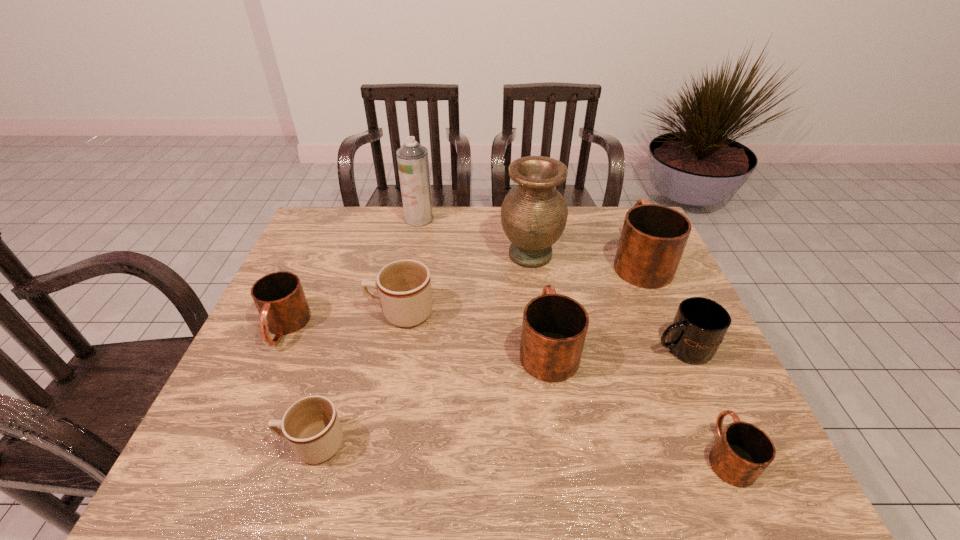
Find the location of `free space located on the side of the bigger brown mug with the handle`. free space located on the side of the bigger brown mug with the handle is located at coordinates (313, 313).

Where is `free region located 0.260m on the side of the bigger brown mug with the handle`? free region located 0.260m on the side of the bigger brown mug with the handle is located at coordinates (273, 313).

Where is `free space located with the handle on the side of the black mug`? Image resolution: width=960 pixels, height=540 pixels. free space located with the handle on the side of the black mug is located at coordinates (577, 348).

Identify the location of vacant space located with the handle on the side of the black mug. (609, 348).

Locate an element on the screen. This screenshot has height=540, width=960. free space located 0.210m with the handle on the side of the black mug is located at coordinates (569, 348).

This screenshot has height=540, width=960. In order to click on vacant space situated on the side of the leftmost object with the handle in this screenshot , I will do `click(214, 483)`.

Locate an element on the screen. free space located 0.110m on the side of the smaller brown mug with the handle is located at coordinates (228, 444).

Where is `blank space located on the side of the smaller brown mug with the handle`? The image size is (960, 540). blank space located on the side of the smaller brown mug with the handle is located at coordinates (247, 444).

You are a GUI agent. You are given a task and a screenshot of the screen. Output one action in this format:
    pyautogui.click(x=<x>, y=<y>)
    Task: Click on the vacant space located 0.100m on the side of the smaller brown mug with the handle
    This screenshot has width=960, height=540.
    Given the screenshot: What is the action you would take?
    pyautogui.click(x=232, y=444)

Where is `free space located 0.400m on the side of the nearest rust mug with the handle`? The height and width of the screenshot is (540, 960). free space located 0.400m on the side of the nearest rust mug with the handle is located at coordinates (659, 297).